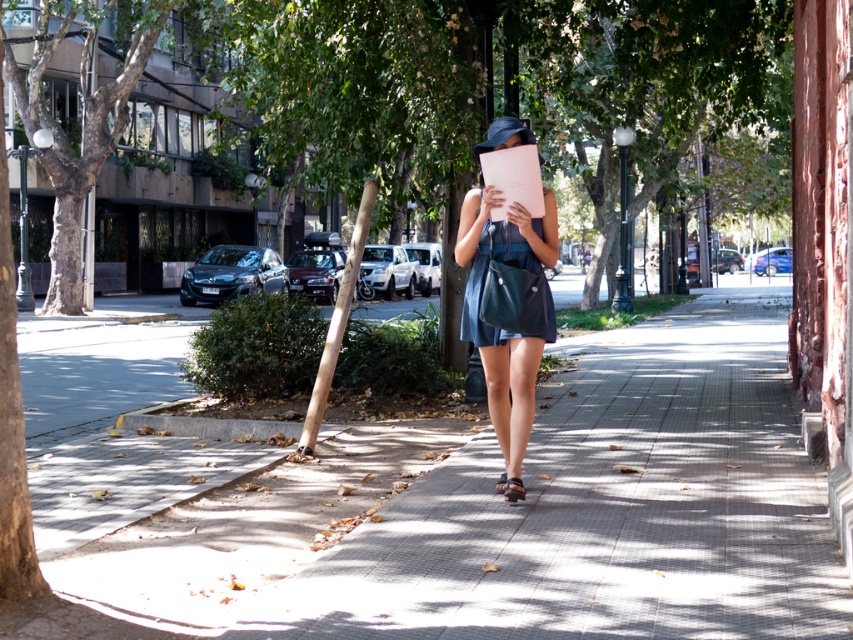
Question: Can you confirm if brown wood pole at center is positioned to the right of brown leather sandal at lower center?

Choices:
 (A) yes
 (B) no

Answer: (B)

Question: Can you confirm if green leafy tree at center is positioned to the left of brown wood pole at center?

Choices:
 (A) no
 (B) yes

Answer: (A)

Question: Based on their relative distances, which object is nearer to the brown leather sandal at center?

Choices:
 (A) denim dress at center
 (B) brown wood pole at center
 (C) smooth brown tree trunk at left

Answer: (A)

Question: Which of the following is the closest to the observer?

Choices:
 (A) smooth concrete pavement at center
 (B) green leafy tree at center
 (C) brown leather sandal at lower center

Answer: (A)

Question: Which object is the closest to the green leafy tree at center?

Choices:
 (A) matte blue dress at center
 (B) denim dress at center
 (C) smooth brown tree trunk at left
 (D) brown leather sandal at lower center

Answer: (C)

Question: Can you confirm if smooth brown tree trunk at left is smaller than brown leather sandal at lower center?

Choices:
 (A) no
 (B) yes

Answer: (A)